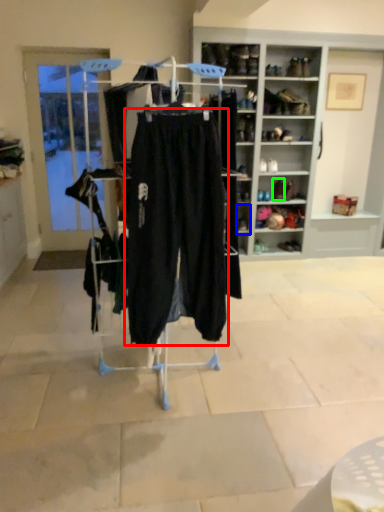
Question: Which is nearer to the trousers (highlighted by a red box)? shelf (highlighted by a blue box) or footwear (highlighted by a green box).

Choices:
 (A) shelf
 (B) footwear

Answer: (A)